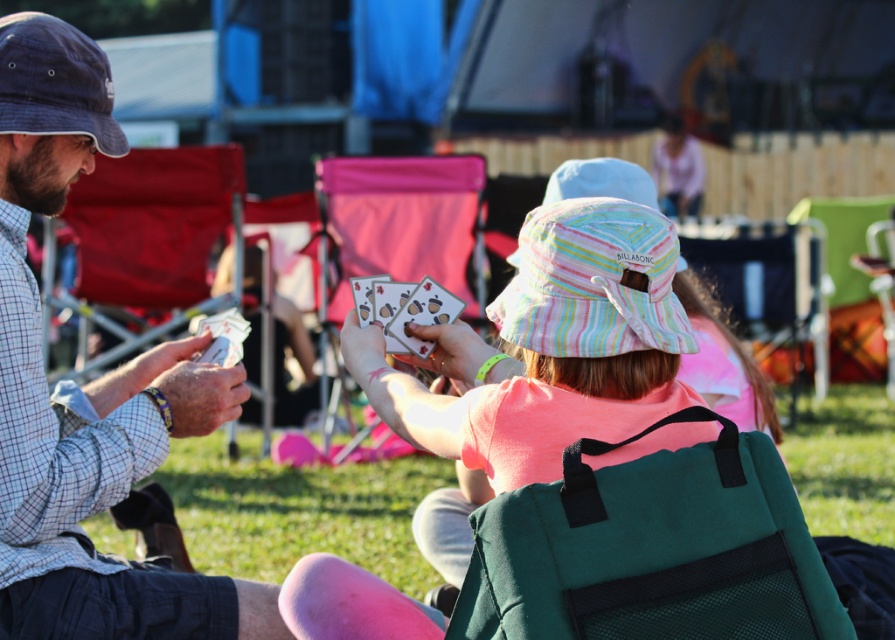
What is the position of the pink fabric shirt at center?

The pink fabric shirt at center is located at point 0.545 on the x axis and 0.615 on the y axis.